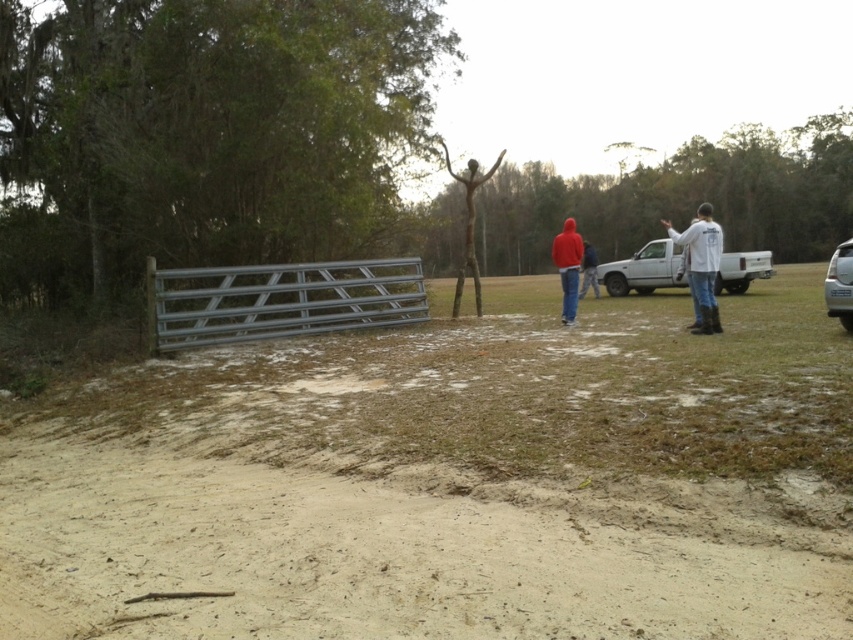
Who is taller, white matte shirt at right or red matte hoodie at center?

white matte shirt at right

Does point (711, 225) come behind point (566, 221)?

No, (711, 225) is in front of (566, 221).

Image resolution: width=853 pixels, height=640 pixels. I want to click on white matte shirt at right, so click(x=701, y=266).

Is dull brown dirt at center to the left of red matte hoodie at center from the viewer's perspective?

Yes, dull brown dirt at center is to the left of red matte hoodie at center.

Does dull brown dirt at center come in front of red matte hoodie at center?

Yes, dull brown dirt at center is in front of red matte hoodie at center.

Identify the location of dull brown dirt at center. The image size is (853, 640). [x=451, y=480].

The width and height of the screenshot is (853, 640). Identify the location of dull brown dirt at center. (451, 480).

This screenshot has height=640, width=853. Describe the element at coordinates (282, 300) in the screenshot. I see `silver metallic gate at center` at that location.

Who is positioned more to the right, silver metallic gate at center or white matte shirt at right?

From the viewer's perspective, white matte shirt at right appears more on the right side.

At what (x,y) coordinates should I click in order to perform the action: click on silver metallic gate at center. Please return your answer as a coordinate pair (x, y). The image size is (853, 640). Looking at the image, I should click on (282, 300).